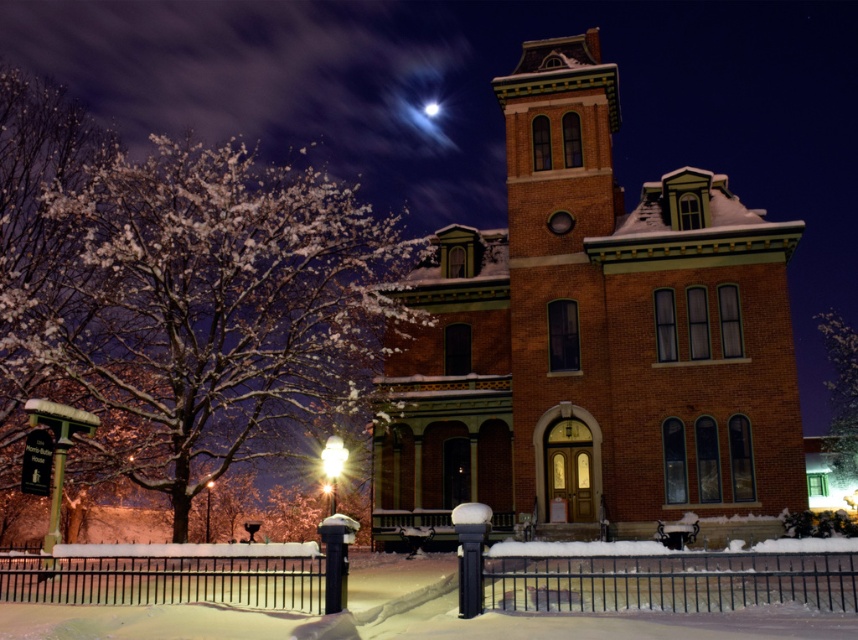
Does brick building at center lie in front of snow-covered branches at left?

Yes, it is.

Between point (429, 385) and point (173, 376), which one is positioned behind?

The point (429, 385) is behind.

Which is behind, point (560, 336) or point (364, 333)?

Positioned behind is point (364, 333).

This screenshot has height=640, width=858. I want to click on brick building at center, so click(591, 340).

Can you confirm if brick building at center is positioned above white snow-covered tree at right?

Indeed, brick building at center is positioned over white snow-covered tree at right.

What do you see at coordinates (591, 340) in the screenshot?
I see `brick building at center` at bounding box center [591, 340].

The width and height of the screenshot is (858, 640). In order to click on brick building at center in this screenshot , I will do `click(591, 340)`.

Looking at this image, which is more to the right, snow-covered branches at left or white snow-covered tree at right?

white snow-covered tree at right

What do you see at coordinates (214, 308) in the screenshot? I see `snow-covered branches at left` at bounding box center [214, 308].

Where is `snow-covered branches at left`? The height and width of the screenshot is (640, 858). snow-covered branches at left is located at coordinates (214, 308).